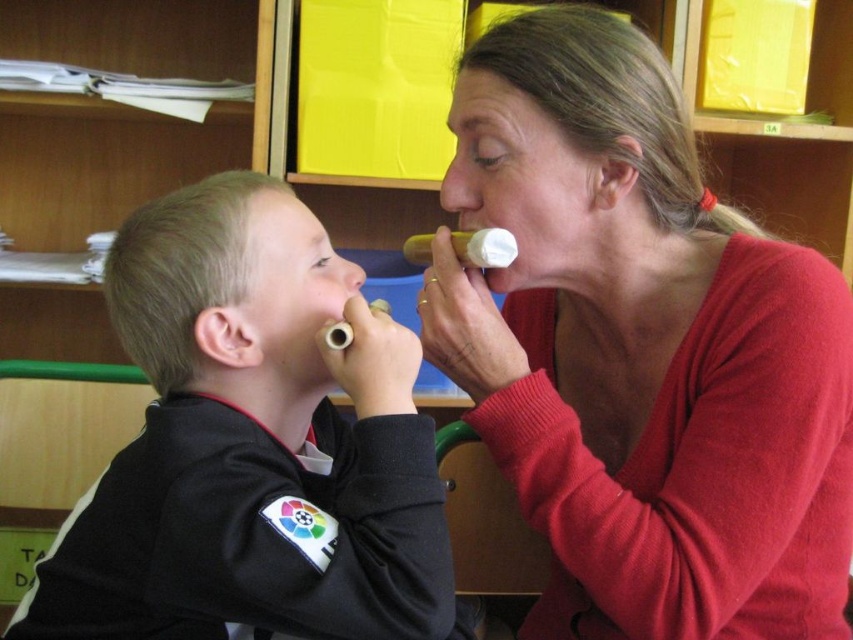
You are a photographer trying to take a picture of the rubber teething ring at lower center. However, the black matte jacket at left is blocking your view. Can you move the jacket to capture the ring clearly?

The black matte jacket at left is in front of the rubber teething ring at lower center, so moving the jacket would allow you to see the ring clearly.